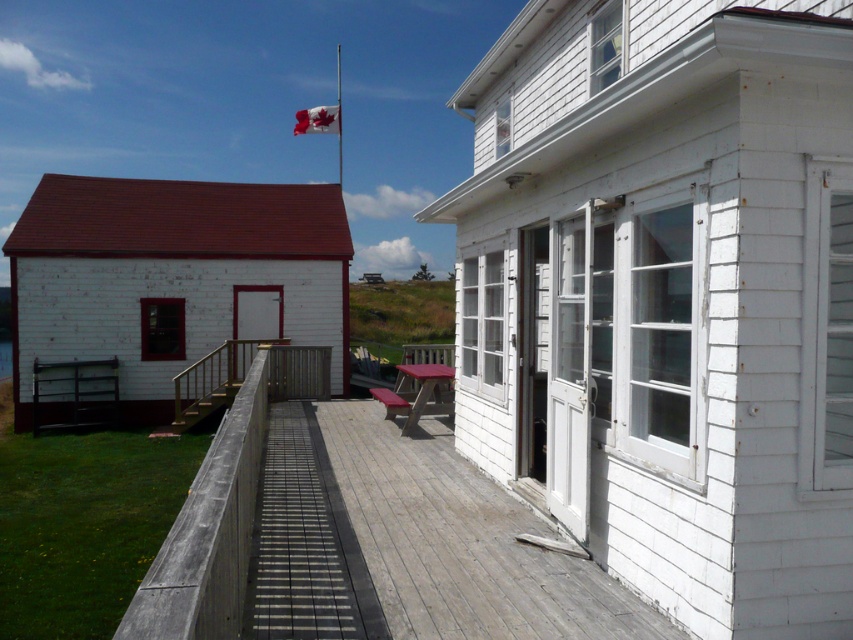
You are standing on the grassy area between the two white wooden buildings. You want to walk towards the wooden at center. Which direction should you walk relative to the white wooden flag pole at upper center?

The wooden at center is in front of the white wooden flag pole at upper center, so you should walk towards the wooden at center in the direction facing away from the flag pole.